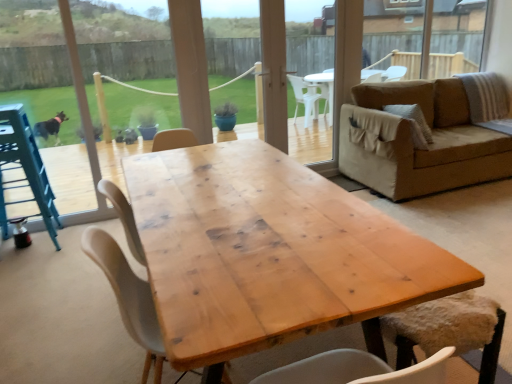
Question: In the image, is transparent plastic screen door at center on the left side or the right side of metallic blue feeding chair at left?

Choices:
 (A) right
 (B) left

Answer: (A)

Question: Considering the positions of transparent plastic screen door at center and metallic blue feeding chair at left in the image, is transparent plastic screen door at center taller or shorter than metallic blue feeding chair at left?

Choices:
 (A) short
 (B) tall

Answer: (B)

Question: Based on their relative distances, which object is farther from the fuzzy white chair at lower right, arranged as the second chair when viewed from the left?

Choices:
 (A) metallic blue feeding chair at left
 (B) white matte chair at center, the first chair in the left-to-right sequence
 (C) natural wood table at center
 (D) transparent plastic screen door at center

Answer: (A)

Question: Which of these objects is positioned closest to the fuzzy white chair at lower right, arranged as the second chair when viewed from the left?

Choices:
 (A) natural wood table at center
 (B) white matte chair at center, the first chair in the left-to-right sequence
 (C) metallic blue feeding chair at left
 (D) transparent plastic screen door at center

Answer: (A)